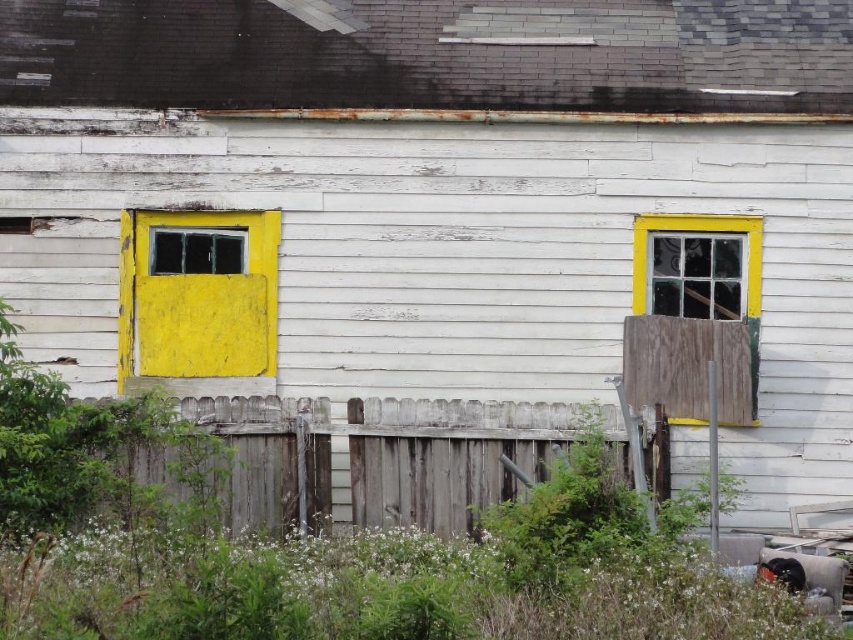
Between weathered wood fence at lower center and yellow painted wood window at left, which one appears on the right side from the viewer's perspective?

weathered wood fence at lower center

Does weathered wood fence at lower center have a lesser height compared to yellow painted wood window at left?

No.

Is point (263, 470) more distant than point (213, 236)?

No, it is in front of (213, 236).

The width and height of the screenshot is (853, 640). Identify the location of weathered wood fence at lower center. (445, 456).

Is yellow matte door at left above yellow painted wood window at left?

No.

What do you see at coordinates (196, 292) in the screenshot?
I see `yellow matte door at left` at bounding box center [196, 292].

Locate an element on the screen. yellow matte door at left is located at coordinates (196, 292).

Image resolution: width=853 pixels, height=640 pixels. I want to click on yellow matte door at left, so click(196, 292).

How far apart are weathered wood fence at lower center and yellow matte door at left?

5.11 feet

Which is behind, point (242, 481) or point (160, 227)?

The point (160, 227) is more distant.

This screenshot has height=640, width=853. Identify the location of weathered wood fence at lower center. (445, 456).